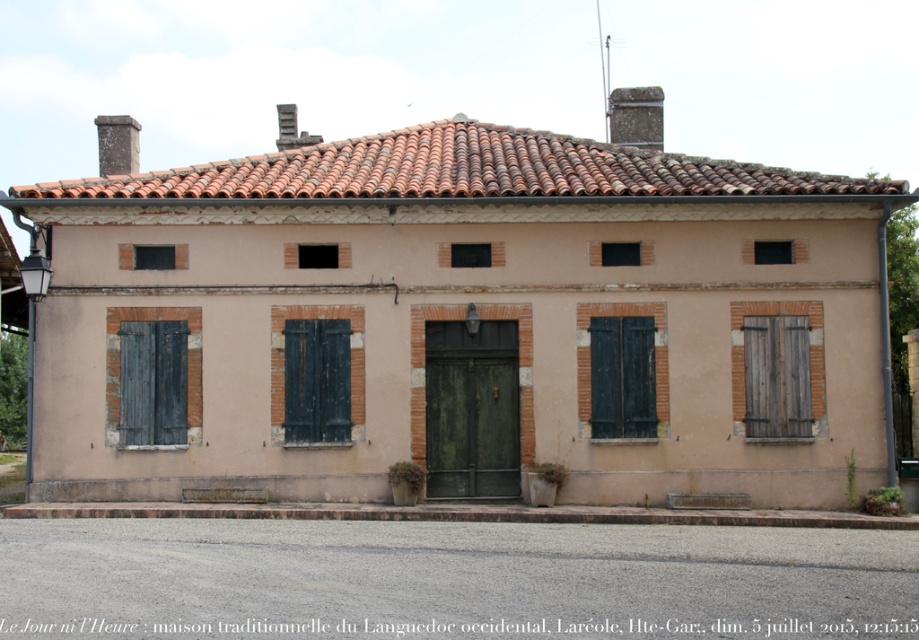
Question: Which object is closer to the camera taking this photo?

Choices:
 (A) dark gray wood shutter at left
 (B) brown wooden shutter at center

Answer: (A)

Question: Which point is farther to the camera?

Choices:
 (A) wooden at right
 (B) dark gray wood shutter at left

Answer: (A)

Question: Is wooden at right above brown wooden shutter at center?

Choices:
 (A) no
 (B) yes

Answer: (B)

Question: Observing the image, what is the correct spatial positioning of dark gray wood shutter at left in reference to black wood shutter at center?

Choices:
 (A) below
 (B) above

Answer: (A)

Question: Which is farther from the dark gray wood shutter at left?

Choices:
 (A) brown wooden shutter at center
 (B) black wood shutter at center

Answer: (A)

Question: Is black wood shutter at center bigger than brown wooden shutter at center?

Choices:
 (A) no
 (B) yes

Answer: (A)